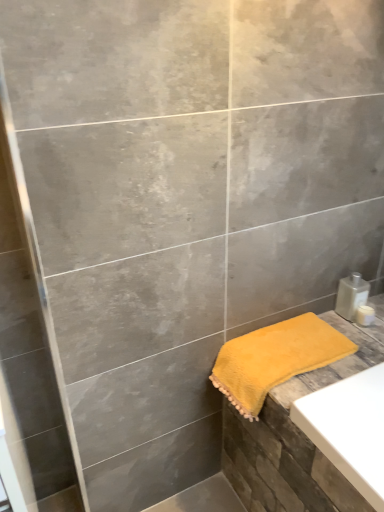
Question: Considering the positions of point (365, 308) and point (344, 303), is point (365, 308) closer or farther from the camera than point (344, 303)?

Choices:
 (A) closer
 (B) farther

Answer: (A)

Question: From their relative heights in the image, would you say white plastic container at right is taller or shorter than clear plastic bottle at lower right?

Choices:
 (A) tall
 (B) short

Answer: (B)

Question: Considering the real-world distances, which object is farthest from the yellow fluffy towel at lower right?

Choices:
 (A) white plastic container at right
 (B) clear plastic bottle at lower right

Answer: (A)

Question: Considering the real-world distances, which object is closest to the white plastic container at right?

Choices:
 (A) yellow fluffy towel at lower right
 (B) clear plastic bottle at lower right

Answer: (B)